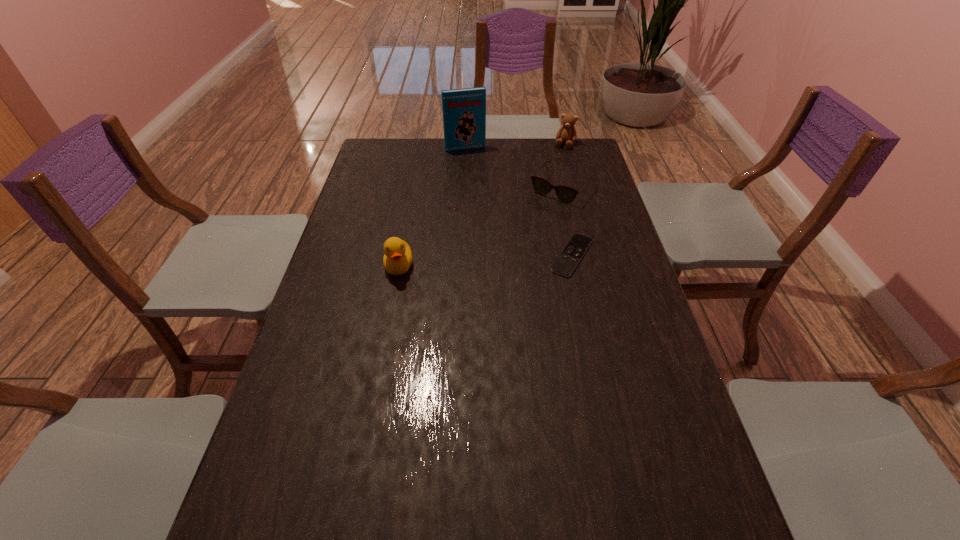
This screenshot has height=540, width=960. Identify the location of vacant space in between the duckling and the book. (432, 207).

The height and width of the screenshot is (540, 960). I want to click on free space between the tallest object and the remote control, so click(518, 202).

Locate an element on the screen. free space between the duckling and the spectacles is located at coordinates (480, 227).

The image size is (960, 540). Find the location of `vacant region between the book and the teddy bear`. vacant region between the book and the teddy bear is located at coordinates (515, 146).

This screenshot has height=540, width=960. I want to click on free spot between the leftmost object and the remote control, so click(x=486, y=261).

What are the coordinates of `free space that is in between the duckling and the second shortest object` in the screenshot? It's located at (480, 227).

Where is `free spot between the book and the duckling`? This screenshot has width=960, height=540. free spot between the book and the duckling is located at coordinates (432, 207).

Select which object is the closest to the tallest object. Please provide its 2D coordinates. Your answer should be formatted as a tuple, i.e. [(x, y)], where the tuple contains the x and y coordinates of a point satisfying the conditions above.

[(566, 194)]

Identify which object is the fourth nearest to the duckling. Please provide its 2D coordinates. Your answer should be formatted as a tuple, i.e. [(x, y)], where the tuple contains the x and y coordinates of a point satisfying the conditions above.

[(567, 133)]

The width and height of the screenshot is (960, 540). I want to click on vacant space that satisfies the following two spatial constraints: 1. on the front side of the fourth tallest object; 2. on the left side of the book, so click(x=464, y=188).